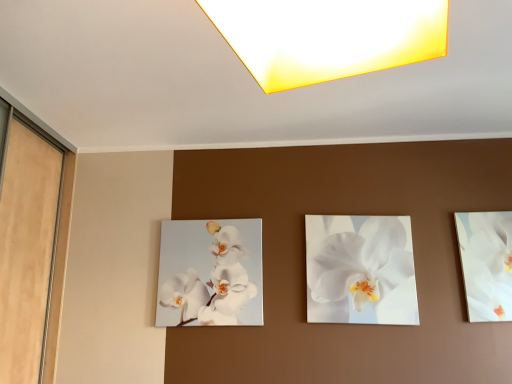
Measure the distance between point (x=254, y=2) and camera.

They are 33.82 inches apart.

This screenshot has width=512, height=384. Identify the location of matte yellow square at upper center. (328, 36).

From the image's perspective, which is below, white glossy orchid at right or white glossy orchid at center, which is the 1th flower in right-to-left order?

white glossy orchid at center, which is the 1th flower in right-to-left order.

Is white glossy orchid at right facing towards white glossy orchid at center, the second flower from the left?

No, white glossy orchid at right does not turn towards white glossy orchid at center, the second flower from the left.

Consider the image. From a real-world perspective, between white glossy orchid at right and white glossy orchid at center, the second flower from the left, who is vertically higher?

white glossy orchid at right is physically above.

Can you tell me how much white glossy orchid at center, the second flower from the left, and white glossy orchid at center, the first flower when ordered from left to right, differ in facing direction?

The angular difference between white glossy orchid at center, the second flower from the left, and white glossy orchid at center, the first flower when ordered from left to right, is 0.0177 degrees.

Is white glossy orchid at center, the second flower from the left, spatially inside white glossy orchid at center, which is counted as the second flower, starting from the right, or outside of it?

white glossy orchid at center, the second flower from the left, cannot be found inside white glossy orchid at center, which is counted as the second flower, starting from the right.

Which object is further away from the camera taking this photo, white glossy orchid at center, the second flower from the left, or white glossy orchid at center, the first flower when ordered from left to right?

Positioned behind is white glossy orchid at center, the first flower when ordered from left to right.

Based on their sizes in the image, would you say white glossy orchid at center, which is the 1th flower in right-to-left order, is bigger or smaller than white glossy orchid at center, the first flower when ordered from left to right?

white glossy orchid at center, which is the 1th flower in right-to-left order, is bigger than white glossy orchid at center, the first flower when ordered from left to right.

From a real-world perspective, which is physically below, matte yellow square at upper center or white glossy orchid at right?

white glossy orchid at right, from a real-world perspective.

Considering the relative sizes of matte yellow square at upper center and white glossy orchid at right in the image provided, is matte yellow square at upper center wider than white glossy orchid at right?

Yes, matte yellow square at upper center is wider than white glossy orchid at right.

From the image's perspective, does matte yellow square at upper center appear lower than white glossy orchid at right?

No.

How many degrees apart are the facing directions of matte yellow square at upper center and white glossy orchid at right?

18.7 degrees separate the facing orientations of matte yellow square at upper center and white glossy orchid at right.

Consider the image. Does white glossy orchid at center, which is counted as the second flower, starting from the right, have a larger size compared to white glossy orchid at right?

Yes, white glossy orchid at center, which is counted as the second flower, starting from the right, is bigger than white glossy orchid at right.

Considering the positions of objects white glossy orchid at center, which is counted as the second flower, starting from the right, and white glossy orchid at right in the image provided, who is more to the right, white glossy orchid at center, which is counted as the second flower, starting from the right, or white glossy orchid at right?

white glossy orchid at right is more to the right.

From a real-world perspective, which object stands above the other?

In real-world perspective, white glossy orchid at right is above.

Between white glossy orchid at center, the second flower from the left, and matte yellow square at upper center, which one has more height?

Standing taller between the two is white glossy orchid at center, the second flower from the left.

Is white glossy orchid at center, which is the 1th flower in right-to-left order, far away from matte yellow square at upper center?

Indeed, white glossy orchid at center, which is the 1th flower in right-to-left order, is not near matte yellow square at upper center.

What's the angular difference between white glossy orchid at center, which is the 1th flower in right-to-left order, and matte yellow square at upper center's facing directions?

white glossy orchid at center, which is the 1th flower in right-to-left order, and matte yellow square at upper center are facing 18.7 degrees away from each other.

Is white glossy orchid at center, which is the 1th flower in right-to-left order, positioned beyond the bounds of matte yellow square at upper center?

white glossy orchid at center, which is the 1th flower in right-to-left order, is positioned outside matte yellow square at upper center.

How far apart are matte yellow square at upper center and white glossy orchid at center, which is the 1th flower in right-to-left order?

matte yellow square at upper center is 1.49 meters from white glossy orchid at center, which is the 1th flower in right-to-left order.

Does matte yellow square at upper center turn towards white glossy orchid at center, the second flower from the left?

No, matte yellow square at upper center is not oriented towards white glossy orchid at center, the second flower from the left.

What's the angular difference between matte yellow square at upper center and white glossy orchid at center, the second flower from the left,'s facing directions?

The facing directions of matte yellow square at upper center and white glossy orchid at center, the second flower from the left, are 18.7 degrees apart.

From a real-world perspective, which object rests below the other?

white glossy orchid at center, the second flower from the left, is physically lower.

Where is `picture frame lying on the right of white glossy orchid at center, the second flower from the left`? picture frame lying on the right of white glossy orchid at center, the second flower from the left is located at coordinates (486, 263).

What's the angular difference between white glossy orchid at center, which is the 1th flower in right-to-left order, and white glossy orchid at right's facing directions?

The facing directions of white glossy orchid at center, which is the 1th flower in right-to-left order, and white glossy orchid at right are 0.0178 degrees apart.

Which is less distant, [347,256] or [468,280]?

The point [468,280] is in front.

Does white glossy orchid at center, the second flower from the left, have a greater width compared to white glossy orchid at right?

No, white glossy orchid at center, the second flower from the left, is not wider than white glossy orchid at right.

Where is `the 1st flower behind the white glossy orchid at right, counting from the anchor's position`? This screenshot has height=384, width=512. the 1st flower behind the white glossy orchid at right, counting from the anchor's position is located at coordinates (360, 270).

Identify the location of flower on the right of the white glossy orchid at center, the first flower when ordered from left to right. Image resolution: width=512 pixels, height=384 pixels. (360, 270).

Considering their positions, is white glossy orchid at center, which is the 1th flower in right-to-left order, positioned further to white glossy orchid at right than matte yellow square at upper center?

matte yellow square at upper center is positioned further to the anchor white glossy orchid at right.

When comparing their distances from matte yellow square at upper center, does white glossy orchid at center, the first flower when ordered from left to right, or white glossy orchid at center, the second flower from the left, seem further?

Among the two, white glossy orchid at center, the second flower from the left, is located further to matte yellow square at upper center.

Consider the image. From the image, which object appears to be nearer to white glossy orchid at center, which is counted as the second flower, starting from the right, matte yellow square at upper center or white glossy orchid at center, the second flower from the left?

white glossy orchid at center, the second flower from the left, is closer to white glossy orchid at center, which is counted as the second flower, starting from the right.

Based on their spatial positions, is white glossy orchid at center, the second flower from the left, or matte yellow square at upper center closer to white glossy orchid at center, the first flower when ordered from left to right?

Among the two, white glossy orchid at center, the second flower from the left, is located nearer to white glossy orchid at center, the first flower when ordered from left to right.

Which object lies further to the anchor point white glossy orchid at center, the second flower from the left, white glossy orchid at center, which is counted as the second flower, starting from the right, or matte yellow square at upper center?

matte yellow square at upper center is positioned further to the anchor white glossy orchid at center, the second flower from the left.

Which object lies nearer to the anchor point white glossy orchid at right, matte yellow square at upper center or white glossy orchid at center, which is counted as the second flower, starting from the right?

white glossy orchid at center, which is counted as the second flower, starting from the right, is positioned closer to the anchor white glossy orchid at right.

Estimate the real-world distances between objects in this image. Which object is further from white glossy orchid at center, the first flower when ordered from left to right, white glossy orchid at right or matte yellow square at upper center?

matte yellow square at upper center lies further to white glossy orchid at center, the first flower when ordered from left to right, than the other object.

From the image, which object appears to be nearer to white glossy orchid at center, the first flower when ordered from left to right, white glossy orchid at right or white glossy orchid at center, the second flower from the left?

white glossy orchid at center, the second flower from the left, lies closer to white glossy orchid at center, the first flower when ordered from left to right, than the other object.

In order to click on picture frame between matte yellow square at upper center and white glossy orchid at center, which is counted as the second flower, starting from the right, in the front-back direction in this screenshot , I will do `click(486, 263)`.

Locate an element on the screen. picture frame between matte yellow square at upper center and white glossy orchid at center, which is the 1th flower in right-to-left order, along the z-axis is located at coordinates (486, 263).

At what (x,y) coordinates should I click in order to perform the action: click on flower between white glossy orchid at center, which is counted as the second flower, starting from the right, and white glossy orchid at right. Please return your answer as a coordinate pair (x, y). Looking at the image, I should click on (360, 270).

The image size is (512, 384). In order to click on flower between matte yellow square at upper center and white glossy orchid at center, the first flower when ordered from left to right, along the z-axis in this screenshot , I will do `click(360, 270)`.